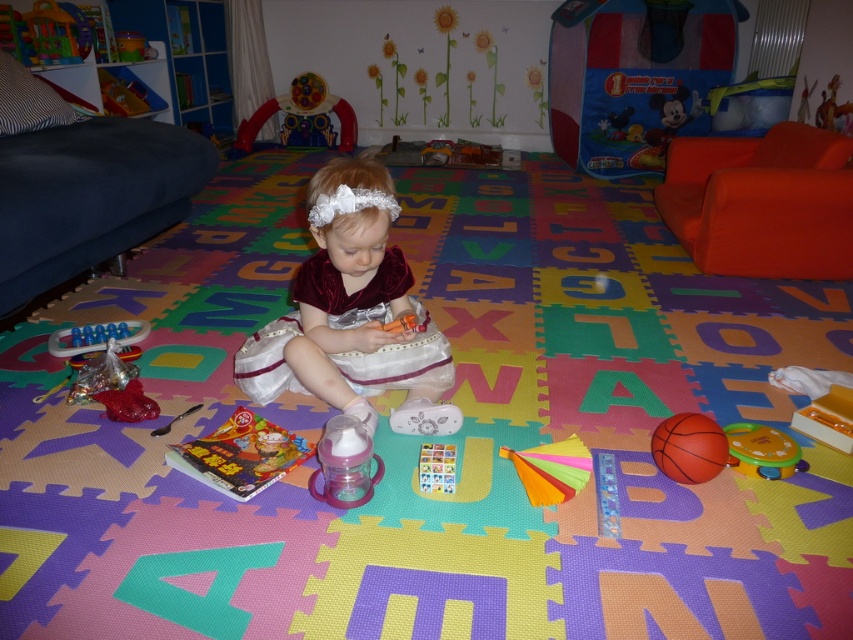
Which is more to the left, plastic colorful arch at upper center or plastic colorful cards at center?

plastic colorful arch at upper center is more to the left.

Is plastic colorful arch at upper center to the right of plastic colorful cards at center from the viewer's perspective?

In fact, plastic colorful arch at upper center is to the left of plastic colorful cards at center.

Between point (254, 112) and point (439, 476), which one is positioned in front?

Positioned in front is point (439, 476).

Locate an element on the screen. plastic colorful arch at upper center is located at coordinates [303, 116].

Can you confirm if orange fabric couch at right is smaller than rubber basketball at center?

No.

Who is higher up, orange fabric couch at right or rubber basketball at center?

orange fabric couch at right

Does point (744, 266) come farther from viewer compared to point (712, 456)?

Yes.

The height and width of the screenshot is (640, 853). Find the location of `orange fabric couch at right`. orange fabric couch at right is located at coordinates 762,202.

Can you confirm if yellow rubber drum at lower right is positioned below rubberized plastic toy at lower left?

Yes.

Between point (730, 445) and point (126, 342), which one is positioned in front?

Point (730, 445) is more forward.

The image size is (853, 640). In order to click on yellow rubber drum at lower right in this screenshot , I will do `click(762, 451)`.